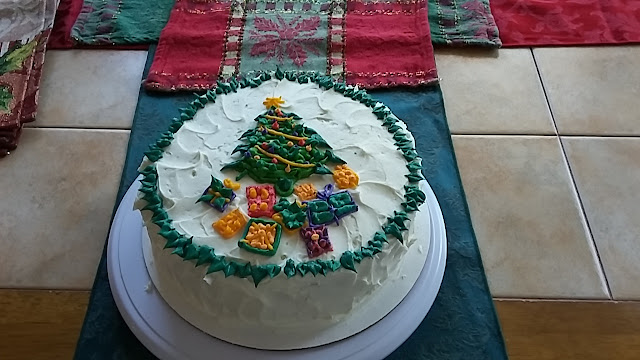
Identify the location of dark green table runner. (470, 321), (432, 120), (150, 112), (108, 337).